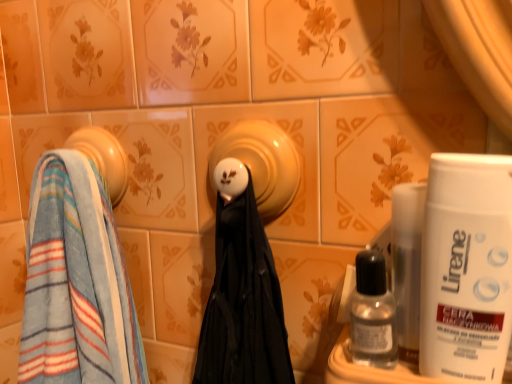
The height and width of the screenshot is (384, 512). What do you see at coordinates (265, 161) in the screenshot? I see `matte yellow ceramic at center` at bounding box center [265, 161].

The height and width of the screenshot is (384, 512). What are the coordinates of `blue striped towel at left, positioned as the 1th towel in top-to-bottom order` in the screenshot? It's located at (103, 158).

Measure the distance between point (477, 230) and camera.

10.98 inches.

Image resolution: width=512 pixels, height=384 pixels. What do you see at coordinates (372, 314) in the screenshot?
I see `transparent plastic bottle at lower right` at bounding box center [372, 314].

At what (x,y) coordinates should I click in order to perform the action: click on matte yellow ceramic at center. Please return your answer as a coordinate pair (x, y). This screenshot has height=384, width=512. Looking at the image, I should click on (265, 161).

How different are the orientations of transparent plastic bottle at lower right and blue striped towel at left, placed as the first towel when sorted from bottom to top, in degrees?

The angle between the facing direction of transparent plastic bottle at lower right and the facing direction of blue striped towel at left, placed as the first towel when sorted from bottom to top, is 4.27 degrees.

Is transparent plastic bottle at lower right to the left or to the right of blue striped towel at left, the second towel viewed from the top, in the image?

In the image, transparent plastic bottle at lower right appears on the right side of blue striped towel at left, the second towel viewed from the top.

Measure the distance from transparent plastic bottle at lower right to blue striped towel at left, the second towel viewed from the top.

A distance of 12.96 inches exists between transparent plastic bottle at lower right and blue striped towel at left, the second towel viewed from the top.

Is transparent plastic bottle at lower right outside of blue striped towel at left, the second towel viewed from the top?

Absolutely, transparent plastic bottle at lower right is external to blue striped towel at left, the second towel viewed from the top.

From the image's perspective, is transparent plastic bottle at lower right located above or below matte yellow ceramic at center?

transparent plastic bottle at lower right is below matte yellow ceramic at center.

Does point (379, 307) come closer to viewer compared to point (203, 176)?

Yes, it is.

Image resolution: width=512 pixels, height=384 pixels. Identify the location of ceramic tile on the left of the transparent plastic bottle at lower right. (265, 161).

Can you confirm if transparent plastic bottle at lower right is shorter than matte yellow ceramic at center?

Yes.

Consider the image. From a real-world perspective, is transparent plastic bottle at lower right above or below white matte shaving cream at right?

In terms of real-world spatial position, transparent plastic bottle at lower right is below white matte shaving cream at right.

Considering the relative sizes of transparent plastic bottle at lower right and white matte shaving cream at right in the image provided, is transparent plastic bottle at lower right shorter than white matte shaving cream at right?

Yes.

Is transparent plastic bottle at lower right wider than white matte shaving cream at right?

In fact, transparent plastic bottle at lower right might be narrower than white matte shaving cream at right.

Is point (393, 321) more distant than point (458, 257)?

Yes.

In the scene shown: Measure the distance from white matte shaving cream at right to blue striped towel at left, the second towel viewed from the top.

The distance of white matte shaving cream at right from blue striped towel at left, the second towel viewed from the top, is 38.55 centimeters.

From the image's perspective, is white matte shaving cream at right under blue striped towel at left, the second towel viewed from the top?

No.

Does point (490, 224) come in front of point (42, 292)?

Yes, point (490, 224) is in front of point (42, 292).

At what (x,y) coordinates should I click in order to perform the action: click on mouthwash located in front of the blue striped towel at left, positioned as the 1th towel in top-to-bottom order. Please return your answer as a coordinate pair (x, y). The height and width of the screenshot is (384, 512). Looking at the image, I should click on (372, 314).

Is transparent plastic bottle at lower right to the left of blue striped towel at left, positioned as the second towel in bottom-to-top order, from the viewer's perspective?

In fact, transparent plastic bottle at lower right is to the right of blue striped towel at left, positioned as the second towel in bottom-to-top order.

Based on the photo, does transparent plastic bottle at lower right contain blue striped towel at left, positioned as the 1th towel in top-to-bottom order?

Actually, blue striped towel at left, positioned as the 1th towel in top-to-bottom order, is outside transparent plastic bottle at lower right.

Is there a large distance between transparent plastic bottle at lower right and blue striped towel at left, positioned as the second towel in bottom-to-top order?

They are positioned close to each other.

Considering the points (494, 208) and (367, 339), which point is in front, point (494, 208) or point (367, 339)?

The point (494, 208) is closer to the camera.

Considering their positions, is white matte shaving cream at right located in front of or behind transparent plastic bottle at lower right?

In the image, white matte shaving cream at right appears in front of transparent plastic bottle at lower right.

Measure the distance from white matte shaving cream at right to transparent plastic bottle at lower right.

2.44 inches.

Which is correct: white matte shaving cream at right is inside transparent plastic bottle at lower right, or outside of it?

white matte shaving cream at right is outside transparent plastic bottle at lower right.

Is matte yellow ceramic at center directly adjacent to blue striped towel at left, the second towel viewed from the top?

No.

Looking at the image, does matte yellow ceramic at center seem bigger or smaller compared to blue striped towel at left, placed as the first towel when sorted from bottom to top?

In the image, matte yellow ceramic at center appears to be smaller than blue striped towel at left, placed as the first towel when sorted from bottom to top.

Which is behind, matte yellow ceramic at center or blue striped towel at left, placed as the first towel when sorted from bottom to top?

matte yellow ceramic at center is further away from the camera.

Is matte yellow ceramic at center wider or thinner than blue striped towel at left, the second towel viewed from the top?

matte yellow ceramic at center is thinner than blue striped towel at left, the second towel viewed from the top.

Identify the location of mouthwash above the blue striped towel at left, placed as the first towel when sorted from bottom to top (from a real-world perspective). (372, 314).

Where is `mouthwash below the matte yellow ceramic at center (from a real-world perspective)`? Image resolution: width=512 pixels, height=384 pixels. mouthwash below the matte yellow ceramic at center (from a real-world perspective) is located at coordinates (372, 314).

When comparing their distances from white matte shaving cream at right, does blue striped towel at left, the second towel viewed from the top, or transparent plastic bottle at lower right seem further?

blue striped towel at left, the second towel viewed from the top, lies further to white matte shaving cream at right than the other object.

Based on the photo, estimate the real-world distances between objects in this image. Which object is closer to blue striped towel at left, the second towel viewed from the top, transparent plastic bottle at lower right or blue striped towel at left, positioned as the second towel in bottom-to-top order?

Based on the image, blue striped towel at left, positioned as the second towel in bottom-to-top order, appears to be nearer to blue striped towel at left, the second towel viewed from the top.

Looking at the image, which one is located further to blue striped towel at left, placed as the first towel when sorted from bottom to top, matte yellow ceramic at center or transparent plastic bottle at lower right?

transparent plastic bottle at lower right.

Which object lies further to the anchor point white matte shaving cream at right, matte yellow ceramic at center or blue striped towel at left, positioned as the second towel in bottom-to-top order?

blue striped towel at left, positioned as the second towel in bottom-to-top order, is positioned further to the anchor white matte shaving cream at right.

Based on their spatial positions, is transparent plastic bottle at lower right or matte yellow ceramic at center further from blue striped towel at left, positioned as the second towel in bottom-to-top order?

transparent plastic bottle at lower right is further to blue striped towel at left, positioned as the second towel in bottom-to-top order.

Based on their spatial positions, is matte yellow ceramic at center or transparent plastic bottle at lower right further from white matte shaving cream at right?

matte yellow ceramic at center is positioned further to the anchor white matte shaving cream at right.

Estimate the real-world distances between objects in this image. Which object is closer to blue striped towel at left, positioned as the 1th towel in top-to-bottom order, white matte shaving cream at right or transparent plastic bottle at lower right?

The object closer to blue striped towel at left, positioned as the 1th towel in top-to-bottom order, is transparent plastic bottle at lower right.

Based on their spatial positions, is white matte shaving cream at right or matte yellow ceramic at center closer to blue striped towel at left, positioned as the 1th towel in top-to-bottom order?

matte yellow ceramic at center is closer to blue striped towel at left, positioned as the 1th towel in top-to-bottom order.

You are a GUI agent. You are given a task and a screenshot of the screen. Output one action in this format:
    pyautogui.click(x=<x>, y=<y>)
    Task: Click on the ceramic tile between blue striped towel at left, the second towel viewed from the top, and white matte shaving cream at right
    
    Given the screenshot: What is the action you would take?
    pyautogui.click(x=265, y=161)

Locate an element on the screen. mouthwash between blue striped towel at left, placed as the first towel when sorted from bottom to top, and white matte shaving cream at right from left to right is located at coordinates (372, 314).

Find the location of a particular element. This screenshot has height=384, width=512. ceramic tile situated between blue striped towel at left, positioned as the second towel in bottom-to-top order, and white matte shaving cream at right from left to right is located at coordinates (265, 161).

What are the coordinates of `towel between blue striped towel at left, the second towel viewed from the top, and matte yellow ceramic at center` in the screenshot? It's located at (103, 158).